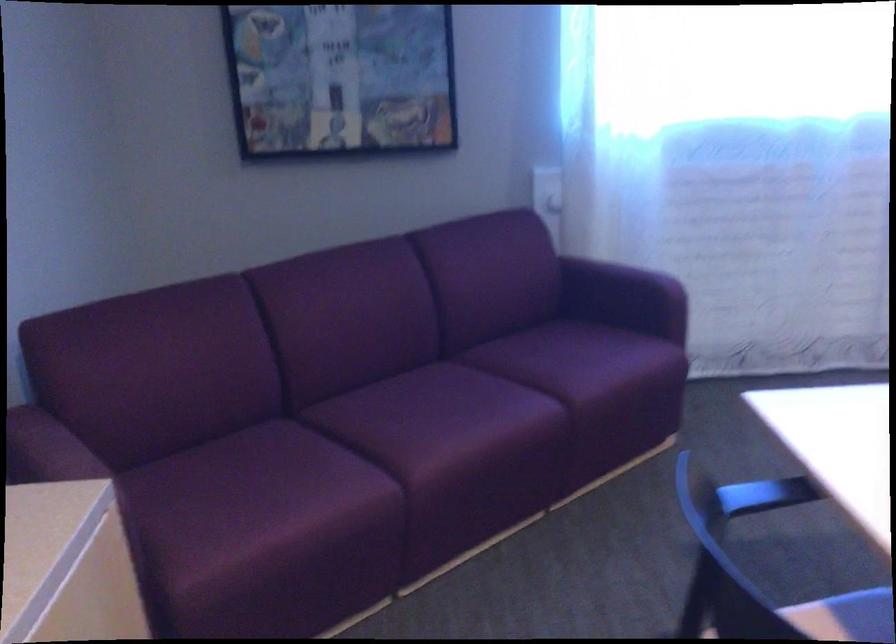
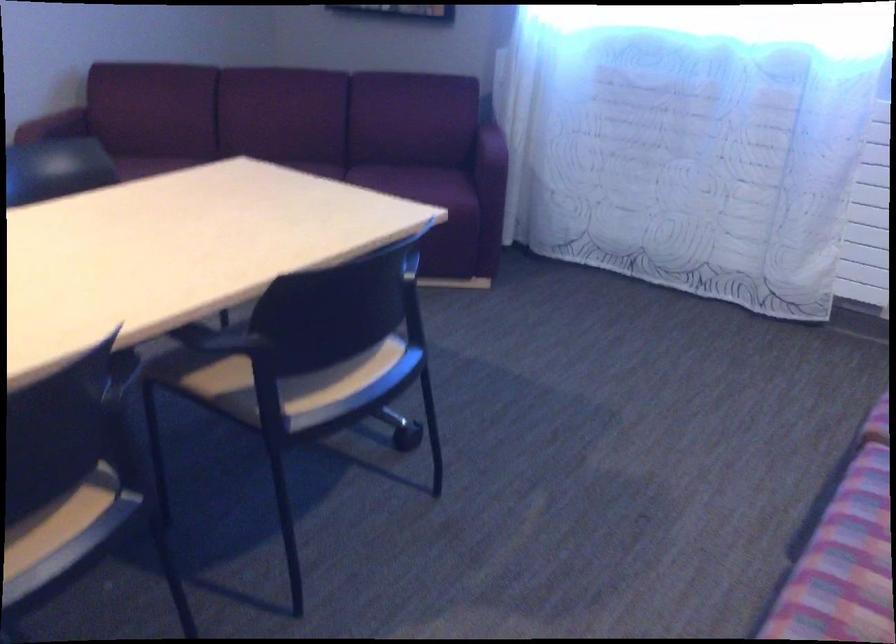
Question: I am providing you with two images of the same scene from different viewpoints. After the viewpoint changes to image2, which objects are now occluded?

Choices:
 (A) sofa sitting surface
 (B) white food can
 (C) black chair armrest
 (D) purple sofa sitting surface

Answer: (D)